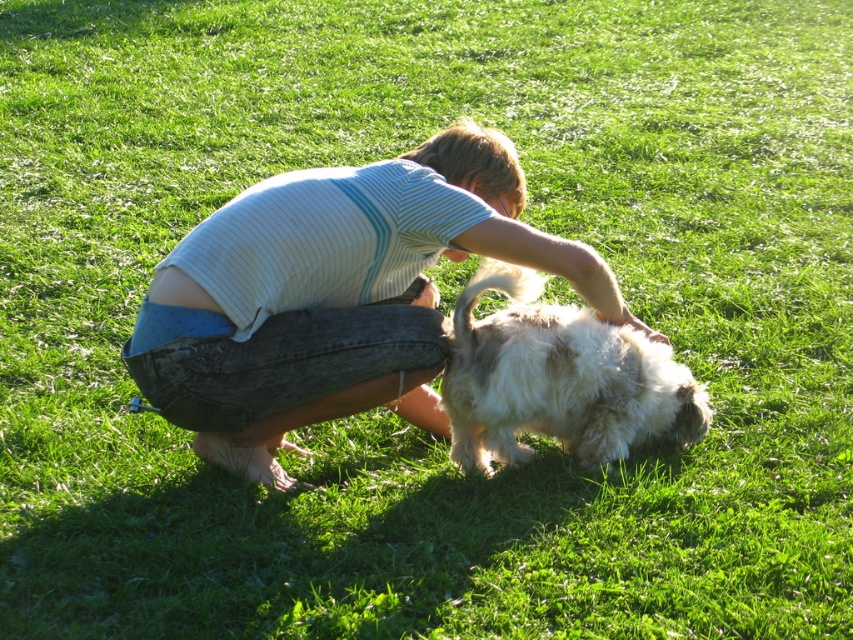
Question: Can you confirm if light blue striped shirt at center is smaller than white fluffy dog at center?

Choices:
 (A) no
 (B) yes

Answer: (A)

Question: Does light blue striped shirt at center appear on the right side of white fluffy dog at center?

Choices:
 (A) yes
 (B) no

Answer: (B)

Question: Which point is closer to the camera?

Choices:
 (A) (535, 275)
 (B) (172, 378)

Answer: (B)

Question: Which point is farther to the camera?

Choices:
 (A) (346, 358)
 (B) (492, 285)

Answer: (B)

Question: Is light blue striped shirt at center in front of white fluffy dog at center?

Choices:
 (A) no
 (B) yes

Answer: (B)

Question: Which point is closer to the camera taking this photo?

Choices:
 (A) (515, 266)
 (B) (247, 196)

Answer: (B)